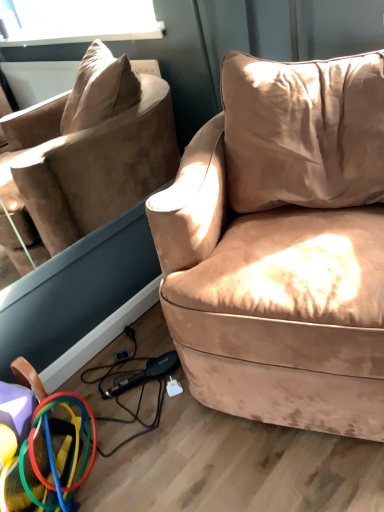
Question: Considering the positions of suede-like beige couch at center-right and rubberized plastic rings at lower left in the image, is suede-like beige couch at center-right bigger or smaller than rubberized plastic rings at lower left?

Choices:
 (A) big
 (B) small

Answer: (A)

Question: Considering the positions of suede-like beige couch at center-right and rubberized plastic rings at lower left in the image, is suede-like beige couch at center-right wider or thinner than rubberized plastic rings at lower left?

Choices:
 (A) wide
 (B) thin

Answer: (A)

Question: Estimate the real-world distances between objects in this image. Which object is farther from the suede-like beige couch at center-right?

Choices:
 (A) rubberized plastic rings at lower left
 (B) beige velvet pillow at upper right

Answer: (A)

Question: Based on their relative distances, which object is nearer to the suede-like beige couch at center-right?

Choices:
 (A) rubberized plastic rings at lower left
 (B) beige velvet pillow at upper right

Answer: (B)